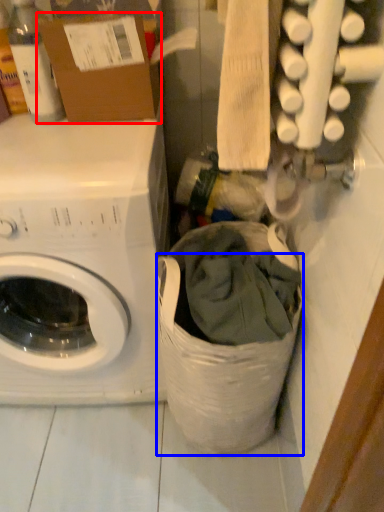
Question: Among these objects, which one is nearest to the camera, cardboard box (highlighted by a red box) or laundry basket (highlighted by a blue box)?

Choices:
 (A) cardboard box
 (B) laundry basket

Answer: (B)